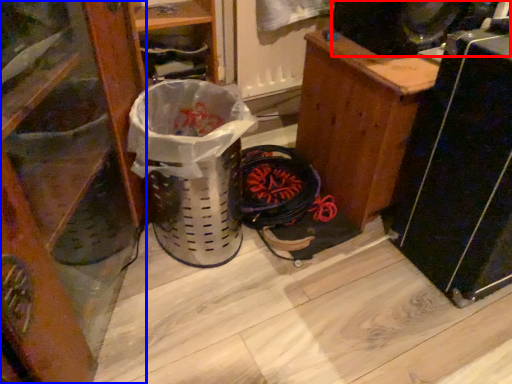
Question: Among these objects, which one is farthest to the camera, speaker (highlighted by a red box) or furniture (highlighted by a blue box)?

Choices:
 (A) speaker
 (B) furniture

Answer: (A)